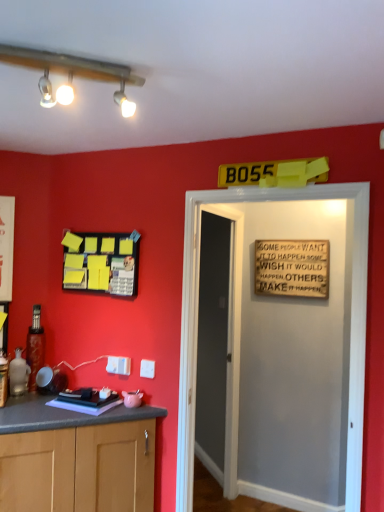
Question: Would you consider yellow matte bulletin board at upper left to be distant from wooden sign at upper center?

Choices:
 (A) yes
 (B) no

Answer: (A)

Question: Is yellow matte bulletin board at upper left taller than wooden sign at upper center?

Choices:
 (A) no
 (B) yes

Answer: (A)

Question: From a real-world perspective, does yellow matte bulletin board at upper left stand above wooden sign at upper center?

Choices:
 (A) no
 (B) yes

Answer: (B)

Question: Would you say yellow matte bulletin board at upper left contains wooden sign at upper center?

Choices:
 (A) no
 (B) yes

Answer: (A)

Question: Is the position of yellow matte bulletin board at upper left more distant than that of wooden sign at upper center?

Choices:
 (A) no
 (B) yes

Answer: (A)

Question: Can you see yellow matte bulletin board at upper left touching wooden sign at upper center?

Choices:
 (A) no
 (B) yes

Answer: (A)

Question: Is smooth gray door at center, positioned as the 1th door in back-to-front order, directly adjacent to yellow matte bulletin board at upper left?

Choices:
 (A) yes
 (B) no

Answer: (B)

Question: Is the position of smooth gray door at center, positioned as the 1th door in back-to-front order, more distant than that of yellow matte bulletin board at upper left?

Choices:
 (A) no
 (B) yes

Answer: (A)

Question: Is smooth gray door at center, the second door in the front-to-back sequence, smaller than yellow matte bulletin board at upper left?

Choices:
 (A) yes
 (B) no

Answer: (B)

Question: From the image's perspective, is smooth gray door at center, positioned as the 1th door in back-to-front order, located beneath yellow matte bulletin board at upper left?

Choices:
 (A) no
 (B) yes

Answer: (B)

Question: Is yellow matte bulletin board at upper left at the back of smooth gray door at center, the second door in the front-to-back sequence?

Choices:
 (A) yes
 (B) no

Answer: (A)

Question: Can you confirm if smooth gray door at center, the second door in the front-to-back sequence, is wider than yellow matte bulletin board at upper left?

Choices:
 (A) yes
 (B) no

Answer: (A)

Question: Is wooden signboard at center, which is the 1th door in front-to-back order, positioned beyond the bounds of yellow matte bulletin board at upper left?

Choices:
 (A) yes
 (B) no

Answer: (A)